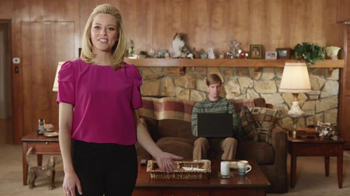
This screenshot has width=350, height=196. Find the location of `coffee mugs`. coffee mugs is located at coordinates (227, 169), (247, 166).